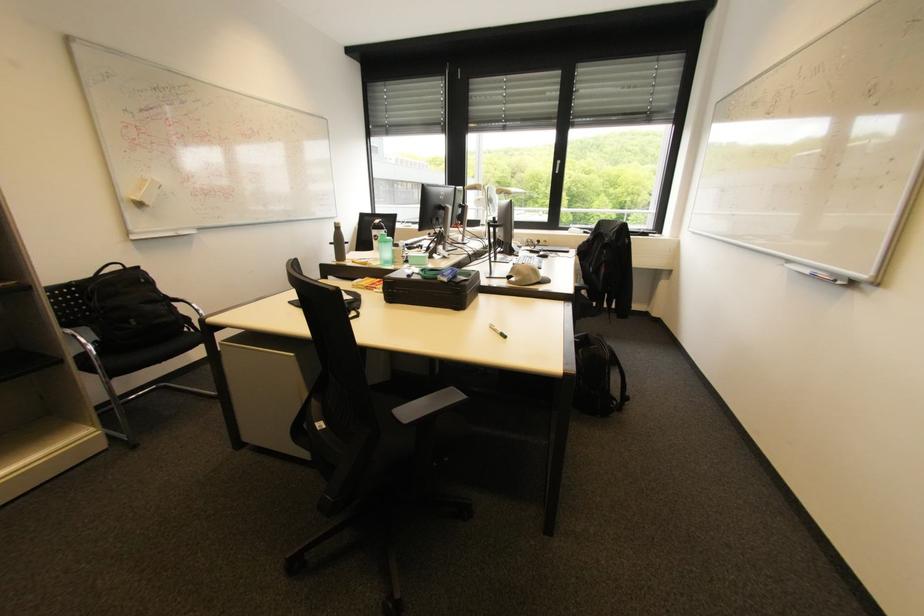
The width and height of the screenshot is (924, 616). Find the location of `white window handle`. white window handle is located at coordinates (556, 166).